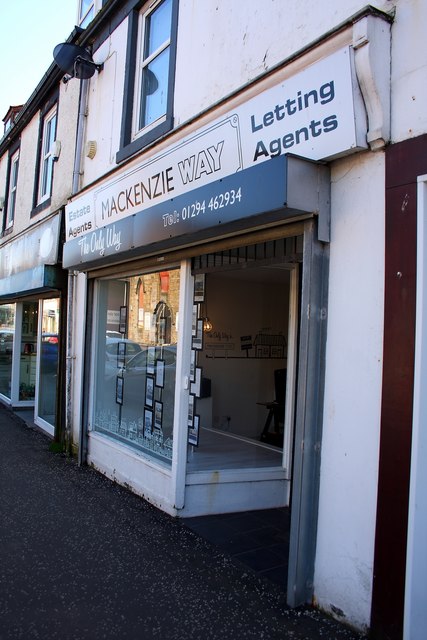
The width and height of the screenshot is (427, 640). Find the location of `picture`. picture is located at coordinates (120, 394).